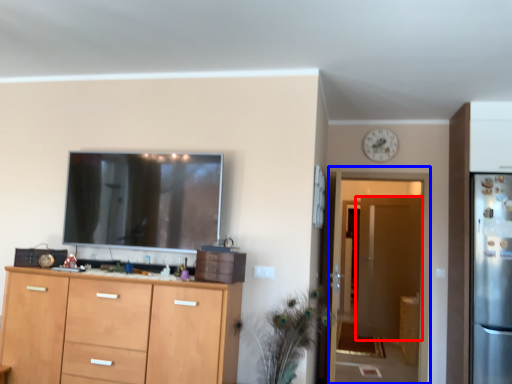
Question: Which of the following is the closest to the observer, door (highlighted by a red box) or glass door (highlighted by a blue box)?

Choices:
 (A) door
 (B) glass door

Answer: (B)